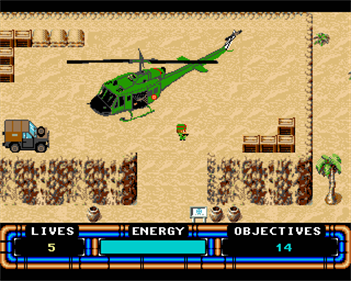
You are a GUI agent. You are given a task and a screenshot of the screen. Output one action in this format:
    pyautogui.click(x=<x>, y=<y>)
    Task: Click on the vases
    
    Given the screenshot: What is the action you would take?
    pyautogui.click(x=94, y=219), pyautogui.click(x=214, y=217), pyautogui.click(x=239, y=215)